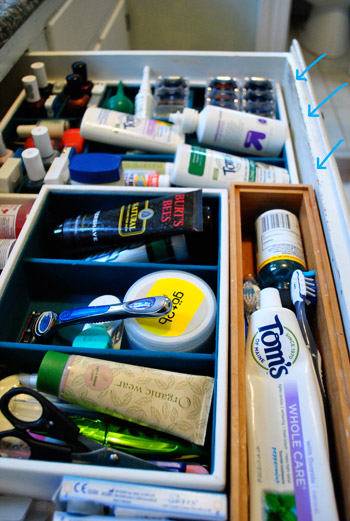
This screenshot has width=350, height=521. I want to click on toothbrushes, so click(x=250, y=300), click(x=304, y=283).